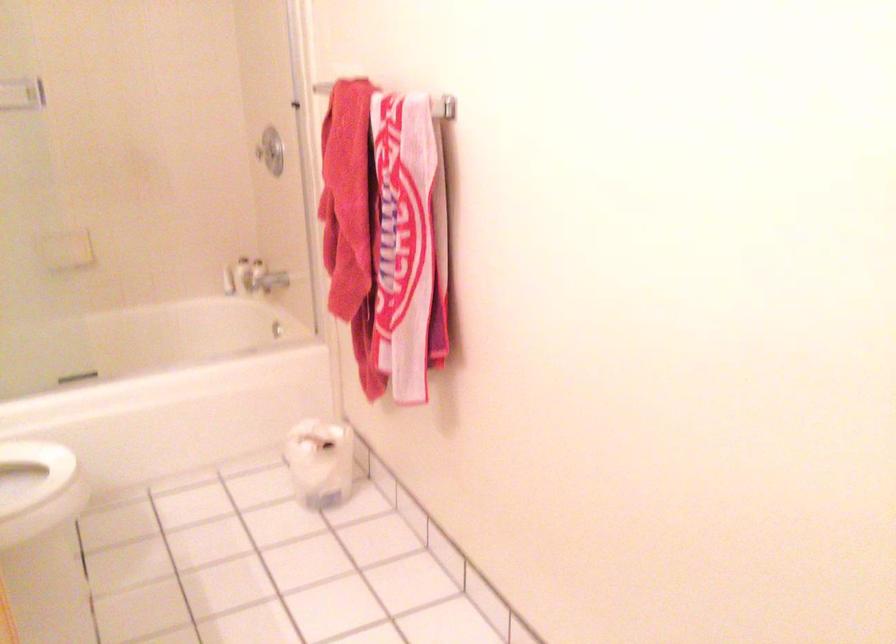
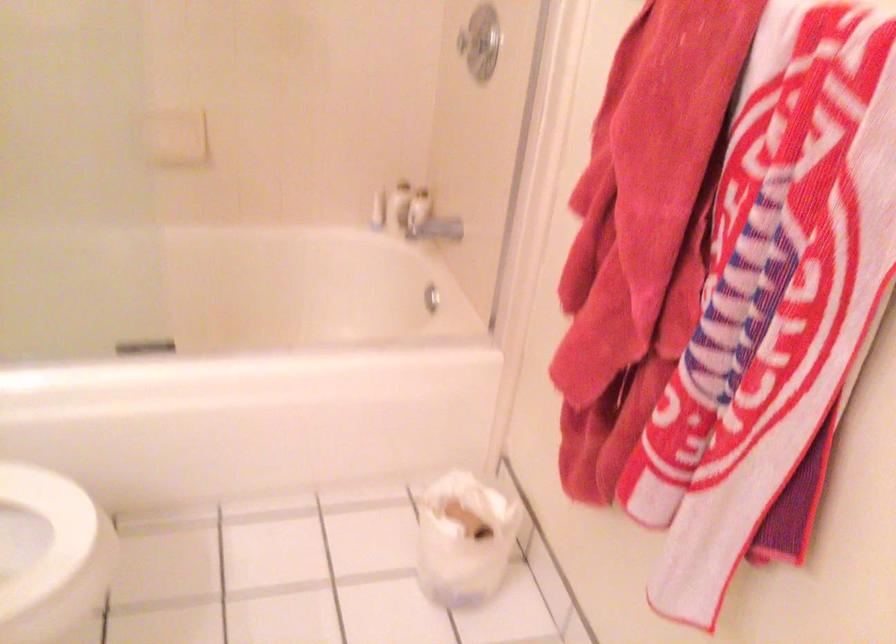
Locate, in the second image, the point that corresponds to the point at 270,149 in the first image.

(478, 42)